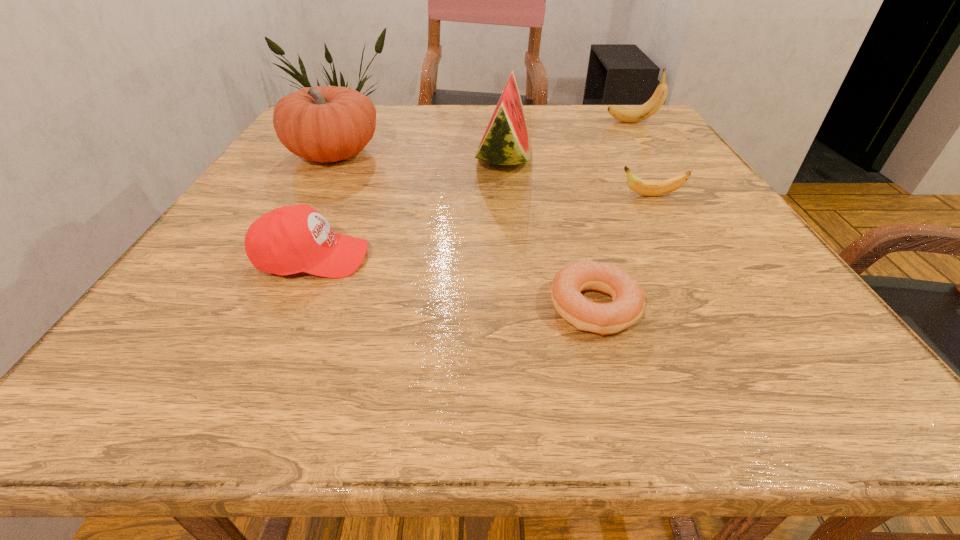
Image resolution: width=960 pixels, height=540 pixels. I want to click on the tallest object, so click(506, 141).

This screenshot has width=960, height=540. Identify the location of pumpkin. (322, 124).

Identify the location of the farther banana. The height and width of the screenshot is (540, 960). (629, 115).

Where is `the farthest object`? The height and width of the screenshot is (540, 960). the farthest object is located at coordinates (629, 115).

The width and height of the screenshot is (960, 540). I want to click on the third shortest object, so click(291, 239).

Locate an element on the screen. the fifth tallest object is located at coordinates (647, 188).

Identify the location of the shorter banana. (647, 188).

Locate an element on the screen. The height and width of the screenshot is (540, 960). bagel is located at coordinates (628, 297).

What are the coordinates of `vacant space situated on the outer rind of the tallest object` in the screenshot? It's located at (313, 157).

Locate an element on the screen. The image size is (960, 540). free location located 0.340m on the outer rind of the tallest object is located at coordinates (330, 157).